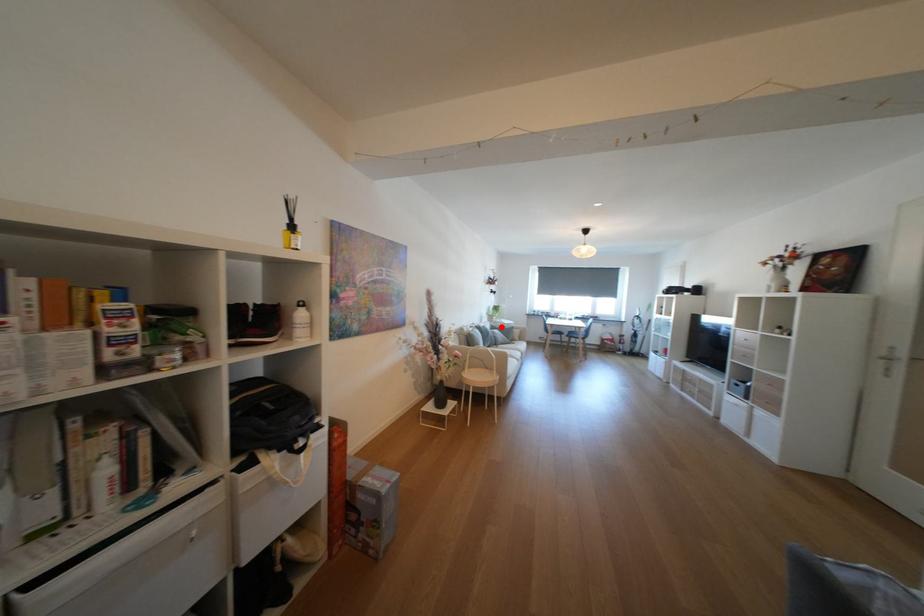
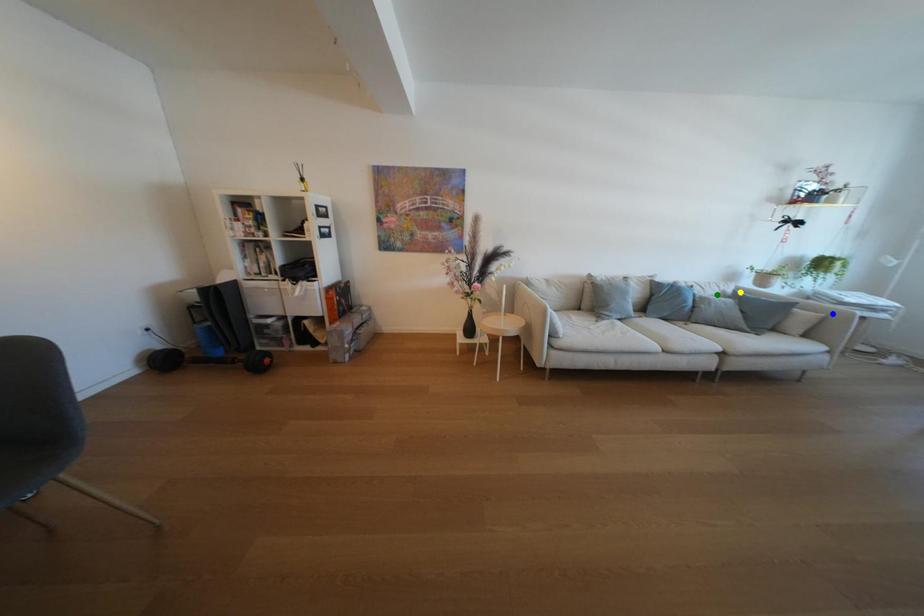
Question: I am providing you with two images of the same scene from different viewpoints. A red point is marked on the first image. You are given multiple points on the second image. Can you choose the point in image 2 that corresponds to the point in image 1?

Choices:
 (A) yellow point
 (B) green point
 (C) blue point

Answer: (A)